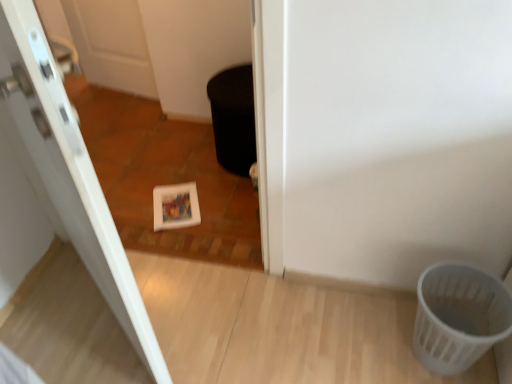
Question: Is black matte potty at center in contact with white plastic basket at lower right?

Choices:
 (A) no
 (B) yes

Answer: (A)

Question: From the image's perspective, does black matte potty at center appear lower than white plastic basket at lower right?

Choices:
 (A) yes
 (B) no

Answer: (B)

Question: From a real-world perspective, is black matte potty at center on top of white plastic basket at lower right?

Choices:
 (A) no
 (B) yes

Answer: (B)

Question: Does black matte potty at center lie behind white plastic basket at lower right?

Choices:
 (A) yes
 (B) no

Answer: (A)

Question: From the image's perspective, is black matte potty at center located above white plastic basket at lower right?

Choices:
 (A) yes
 (B) no

Answer: (A)

Question: Considering the positions of black matte potty at center and white glossy door at upper left in the image, is black matte potty at center bigger or smaller than white glossy door at upper left?

Choices:
 (A) big
 (B) small

Answer: (B)

Question: Considering their positions, is black matte potty at center located in front of or behind white glossy door at upper left?

Choices:
 (A) behind
 (B) front

Answer: (A)

Question: Considering the positions of point (241, 127) and point (59, 213), is point (241, 127) closer or farther from the camera than point (59, 213)?

Choices:
 (A) closer
 (B) farther

Answer: (B)

Question: From the image's perspective, is black matte potty at center above or below white glossy door at upper left?

Choices:
 (A) below
 (B) above

Answer: (B)

Question: Is point tap(32, 130) positioned closer to the camera than point tap(428, 301)?

Choices:
 (A) closer
 (B) farther

Answer: (A)

Question: Do you think white glossy door at upper left is within white plastic basket at lower right, or outside of it?

Choices:
 (A) inside
 (B) outside

Answer: (B)

Question: From the image's perspective, is white glossy door at upper left located above or below white plastic basket at lower right?

Choices:
 (A) above
 (B) below

Answer: (A)

Question: Considering the positions of white glossy door at upper left and white plastic basket at lower right in the image, is white glossy door at upper left bigger or smaller than white plastic basket at lower right?

Choices:
 (A) small
 (B) big

Answer: (B)

Question: Visually, is white plastic basket at lower right positioned to the left or to the right of black matte potty at center?

Choices:
 (A) right
 (B) left

Answer: (A)

Question: From a real-world perspective, relative to black matte potty at center, is white plastic basket at lower right vertically above or below?

Choices:
 (A) below
 (B) above

Answer: (A)